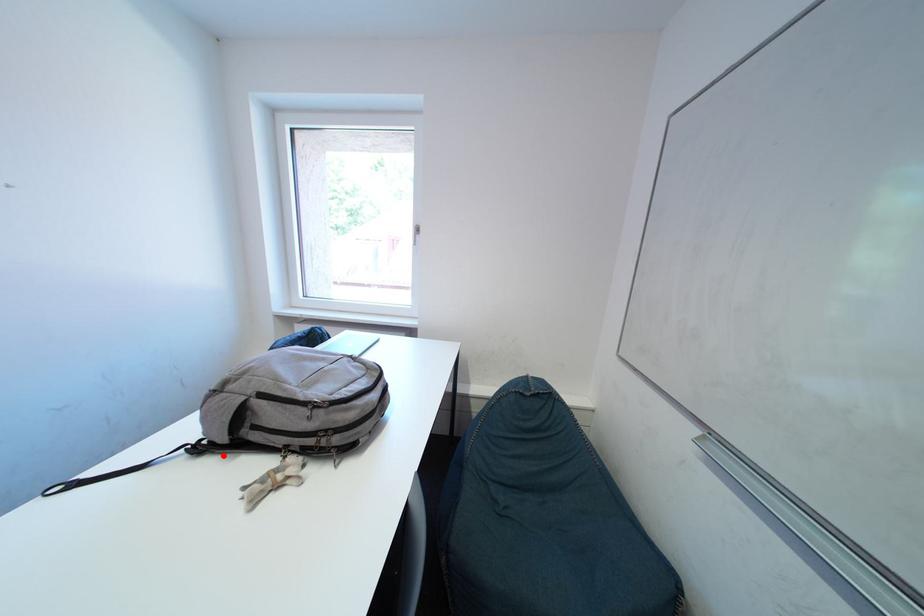
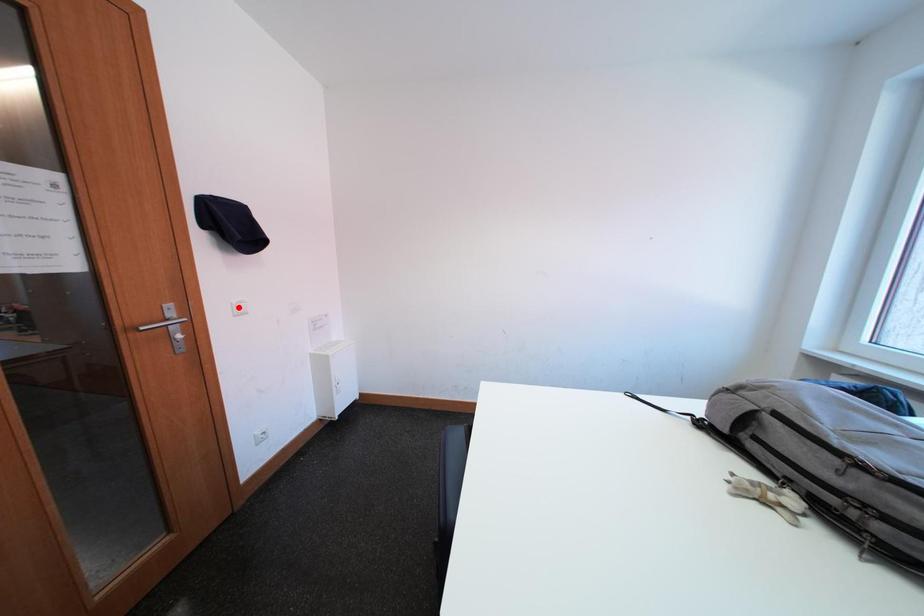
I am providing you with two images of the same scene from different viewpoints. A red point is marked on the first image and another point is marked on the second image. Do the highlighted points in image1 and image2 indicate the same real-world spot?

No